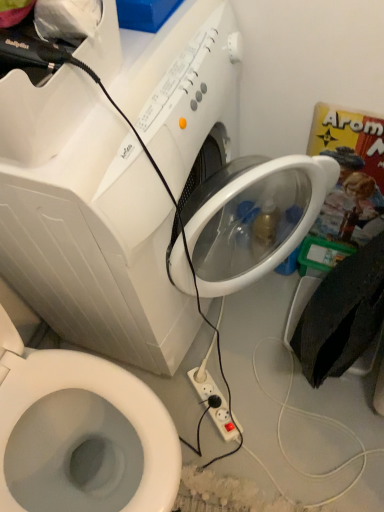
Question: From the image's perspective, is white plastic power plugs and sockets at lower center located beneath white plastic bidet at lower left?

Choices:
 (A) no
 (B) yes

Answer: (B)

Question: From a real-world perspective, is white plastic power plugs and sockets at lower center on top of white plastic bidet at lower left?

Choices:
 (A) no
 (B) yes

Answer: (A)

Question: Can white plastic bidet at lower left be found inside white plastic power plugs and sockets at lower center?

Choices:
 (A) no
 (B) yes

Answer: (A)

Question: Is white plastic power plugs and sockets at lower center closer to the viewer compared to white plastic bidet at lower left?

Choices:
 (A) yes
 (B) no

Answer: (B)

Question: Is white plastic power plugs and sockets at lower center wider than white plastic bidet at lower left?

Choices:
 (A) no
 (B) yes

Answer: (A)

Question: Based on their sizes in the image, would you say white plastic washing machine at upper center is bigger or smaller than white plastic bidet at lower left?

Choices:
 (A) big
 (B) small

Answer: (A)

Question: Considering their positions, is white plastic washing machine at upper center located in front of or behind white plastic bidet at lower left?

Choices:
 (A) front
 (B) behind

Answer: (B)

Question: Considering the positions of white plastic washing machine at upper center and white plastic bidet at lower left in the image, is white plastic washing machine at upper center wider or thinner than white plastic bidet at lower left?

Choices:
 (A) wide
 (B) thin

Answer: (B)

Question: In terms of height, does white plastic washing machine at upper center look taller or shorter compared to white plastic bidet at lower left?

Choices:
 (A) tall
 (B) short

Answer: (A)

Question: From a real-world perspective, relative to white plastic power plugs and sockets at lower center, is white plastic bidet at lower left vertically above or below?

Choices:
 (A) above
 (B) below

Answer: (A)

Question: Is white plastic bidet at lower left bigger or smaller than white plastic power plugs and sockets at lower center?

Choices:
 (A) small
 (B) big

Answer: (B)

Question: From the image's perspective, is white plastic bidet at lower left above or below white plastic power plugs and sockets at lower center?

Choices:
 (A) below
 (B) above

Answer: (B)

Question: Based on their positions, is white plastic bidet at lower left located to the left or right of white plastic power plugs and sockets at lower center?

Choices:
 (A) right
 (B) left

Answer: (B)

Question: Is white plastic bidet at lower left in front of or behind white plastic washing machine at upper center in the image?

Choices:
 (A) front
 (B) behind

Answer: (A)

Question: Is point (127, 468) positioned closer to the camera than point (160, 156)?

Choices:
 (A) closer
 (B) farther

Answer: (B)